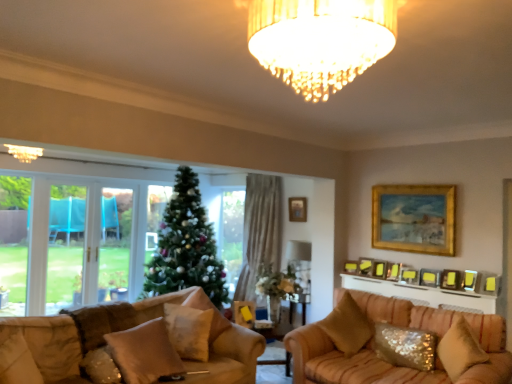
Question: Is there a large distance between suede-like beige pillow at lower left, placed as the 6th pillow when sorted from right to left, and yellow matte picture frame at upper right, acting as the third picture frame starting from the front?

Choices:
 (A) no
 (B) yes

Answer: (B)

Question: Is suede-like beige pillow at lower left, which is the third pillow from left to right, positioned in front of yellow matte picture frame at upper right, acting as the third picture frame starting from the front?

Choices:
 (A) no
 (B) yes

Answer: (B)

Question: Is suede-like beige pillow at lower left, which is the third pillow from left to right, surrounding yellow matte picture frame at upper right, acting as the third picture frame starting from the front?

Choices:
 (A) no
 (B) yes

Answer: (A)

Question: From the image's perspective, is suede-like beige pillow at lower left, placed as the 6th pillow when sorted from right to left, over yellow matte picture frame at upper right, the sixth picture frame positioned from the back?

Choices:
 (A) no
 (B) yes

Answer: (A)

Question: Is suede-like beige pillow at lower left, which is the third pillow from left to right, outside of yellow matte picture frame at upper right, acting as the third picture frame starting from the front?

Choices:
 (A) no
 (B) yes

Answer: (B)

Question: Does suede-like beige pillow at lower left, which is the third pillow from left to right, have a greater width compared to yellow matte picture frame at upper right, the sixth picture frame positioned from the back?

Choices:
 (A) yes
 (B) no

Answer: (A)

Question: Is sequined fabric pillow at lower right, the 2th pillow from the right, closer to camera compared to gold metallic picture frame at upper center, positioned as the 5th picture frame in front-to-back order?

Choices:
 (A) no
 (B) yes

Answer: (B)

Question: Is sequined fabric pillow at lower right, placed as the 7th pillow when sorted from left to right, oriented towards gold metallic picture frame at upper center, placed as the 4th picture frame when sorted from back to front?

Choices:
 (A) no
 (B) yes

Answer: (A)

Question: From a real-world perspective, is sequined fabric pillow at lower right, the 2th pillow from the right, on top of gold metallic picture frame at upper center, positioned as the 5th picture frame in front-to-back order?

Choices:
 (A) yes
 (B) no

Answer: (B)

Question: Does sequined fabric pillow at lower right, placed as the 7th pillow when sorted from left to right, have a smaller size compared to gold metallic picture frame at upper center, placed as the 4th picture frame when sorted from back to front?

Choices:
 (A) no
 (B) yes

Answer: (A)

Question: Is sequined fabric pillow at lower right, placed as the 7th pillow when sorted from left to right, not inside gold metallic picture frame at upper center, placed as the 4th picture frame when sorted from back to front?

Choices:
 (A) no
 (B) yes

Answer: (B)

Question: Can you confirm if sequined fabric pillow at lower right, placed as the 7th pillow when sorted from left to right, is positioned to the left of gold metallic picture frame at upper center, positioned as the 5th picture frame in front-to-back order?

Choices:
 (A) yes
 (B) no

Answer: (A)

Question: Does gold metallic picture frame at upper center, placed as the 4th picture frame when sorted from back to front, have a greater height compared to wooden picture frame at upper right, which is the 8th picture frame in back-to-front order?

Choices:
 (A) yes
 (B) no

Answer: (A)